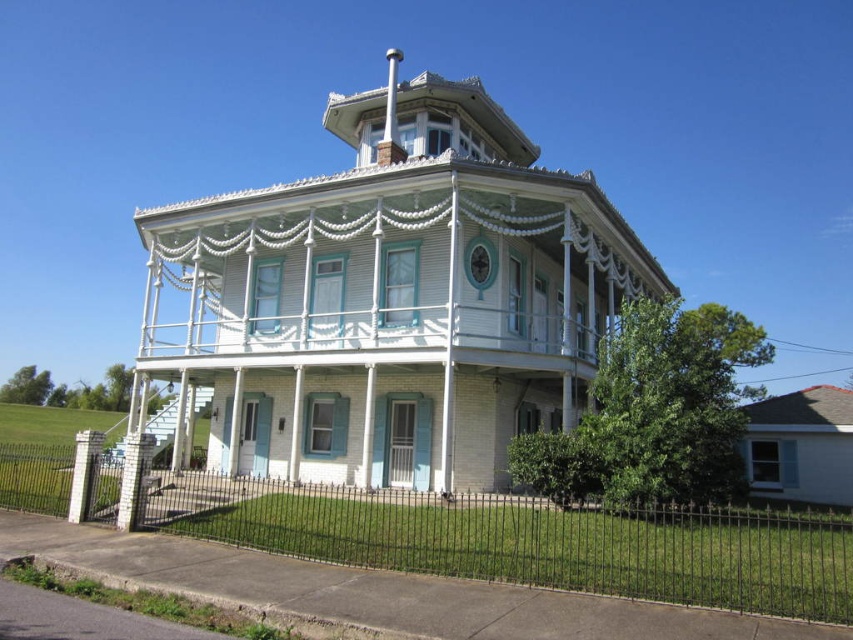
Question: Can you confirm if black wrought iron fence at lower center is positioned above white wood porch at center?

Choices:
 (A) no
 (B) yes

Answer: (A)

Question: Does black wrought iron fence at lower center have a greater width compared to white wood porch at center?

Choices:
 (A) yes
 (B) no

Answer: (A)

Question: Which point is farther to the camera?

Choices:
 (A) (399, 352)
 (B) (51, 506)

Answer: (A)

Question: Which point appears farthest from the camera in this image?

Choices:
 (A) (444, 568)
 (B) (527, 353)

Answer: (B)

Question: Is black wrought iron fence at lower center wider than white wood porch at center?

Choices:
 (A) yes
 (B) no

Answer: (A)